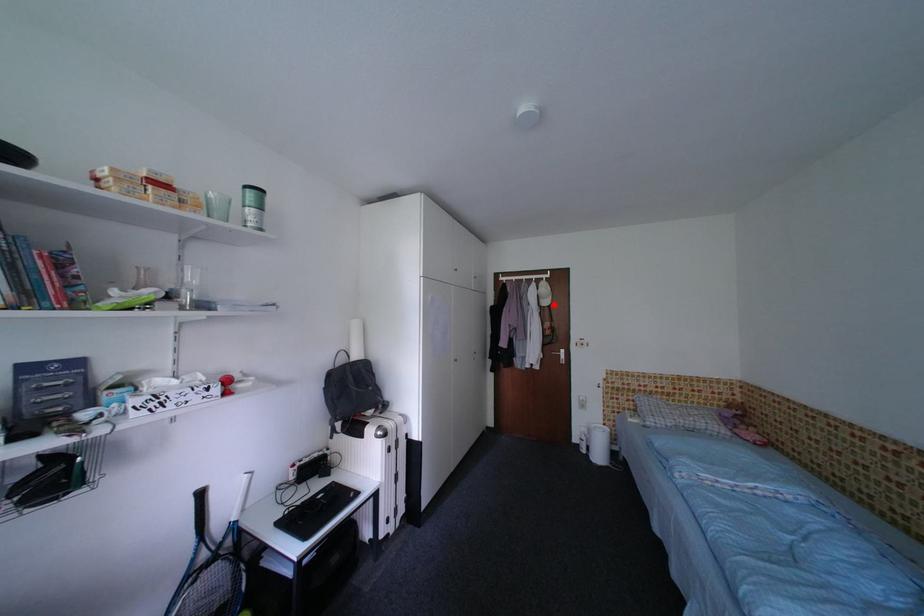
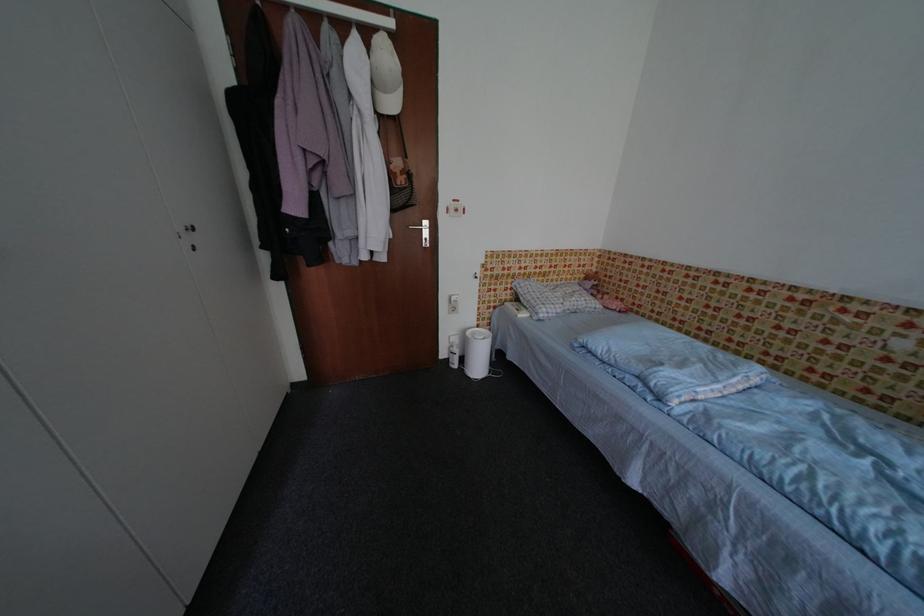
The point at the highlighted location is marked in the first image. Where is the corresponding point in the second image?

(400, 107)